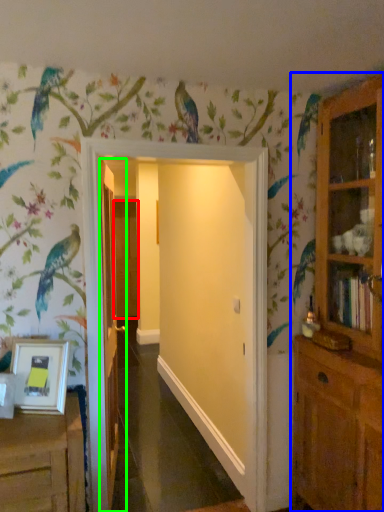
Question: Considering the real-world distances, which object is farthest from door (highlighted by a red box)? cupboard (highlighted by a blue box) or door (highlighted by a green box)?

Choices:
 (A) cupboard
 (B) door

Answer: (A)